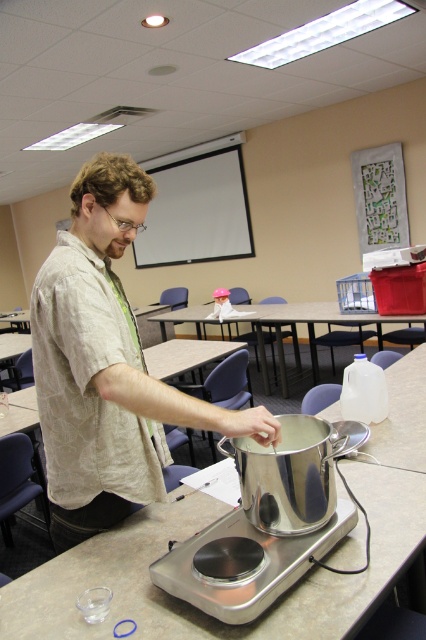
Does matte beige shirt at center have a lesser width compared to silver metallic table at center?

Correct, matte beige shirt at center's width is less than silver metallic table at center's.

Between matte beige shirt at center and silver metallic table at center, which one has more height?

matte beige shirt at center

Find the location of a particular element. The height and width of the screenshot is (640, 426). matte beige shirt at center is located at coordinates (106, 365).

Does silver metallic table at center have a lesser height compared to metallic table at center?

Yes, silver metallic table at center is shorter than metallic table at center.

Is silver metallic table at center closer to camera compared to metallic table at center?

Yes, it is.

Locate an element on the screen. silver metallic table at center is located at coordinates (195, 609).

Find the location of a particular element. silver metallic table at center is located at coordinates (195, 609).

This screenshot has width=426, height=640. I want to click on matte beige shirt at center, so click(106, 365).

Who is higher up, matte beige shirt at center or metallic table at center?

matte beige shirt at center

The height and width of the screenshot is (640, 426). What do you see at coordinates (106, 365) in the screenshot?
I see `matte beige shirt at center` at bounding box center [106, 365].

Locate an element on the screen. This screenshot has width=426, height=640. matte beige shirt at center is located at coordinates (106, 365).